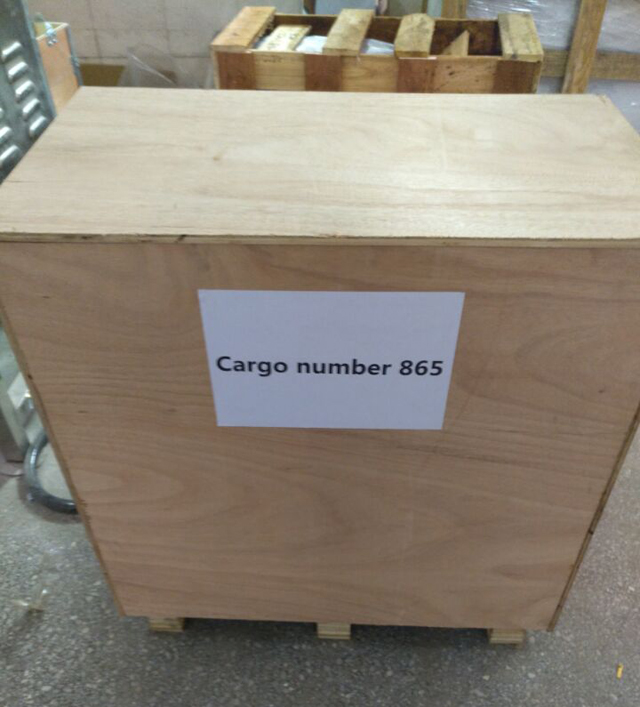
Identify the location of wall stud. tap(580, 64).